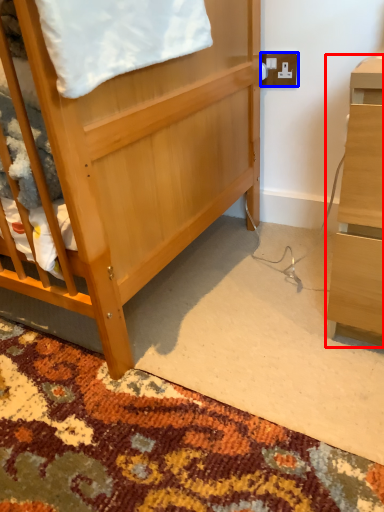
Question: Which point is closer to the camera, desk (highlighted by a red box) or electric outlet (highlighted by a blue box)?

Choices:
 (A) desk
 (B) electric outlet

Answer: (A)